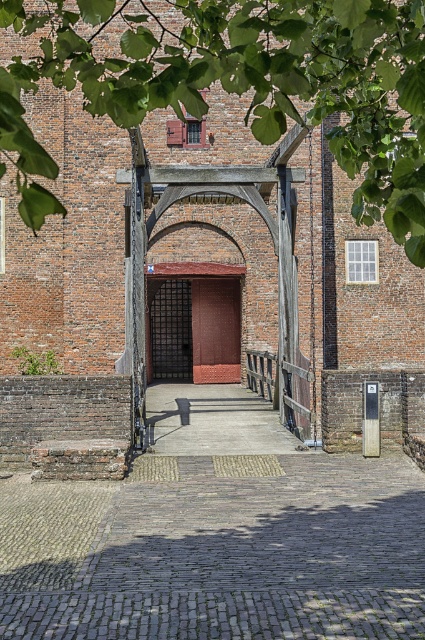
You are a visitor approaching the historic brick structure and notice two doors at the center of the building. Which door, the rustic wooden door at center or the brown wooden door at center, is shorter in height?

The rustic wooden door at center is shorter in height compared to the brown wooden door at center.

You are standing at the entrance of the historic brick structure and want to take a photo of the green leafy tree at upper center and the brick stair at lower left. Which object will appear larger in the photo?

The green leafy tree at upper center will appear larger in the photo because it is much taller than the brick stair at lower left.